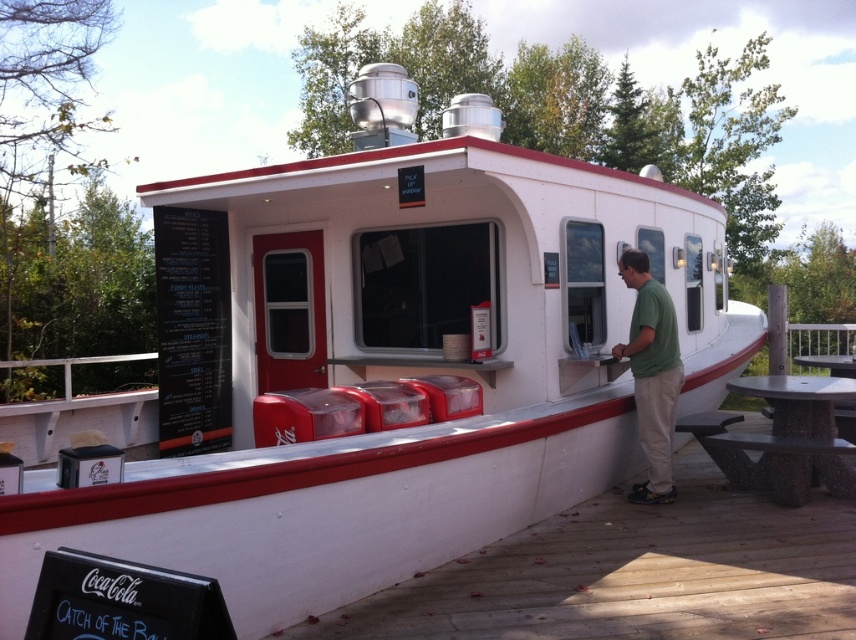
Question: Which object is the farthest from the green cotton shirt at center?

Choices:
 (A) dark brown stone picnic table at lower right
 (B) wooden at lower left

Answer: (B)

Question: Which point is farther to the camera?

Choices:
 (A) (831, 628)
 (B) (831, 424)

Answer: (B)

Question: Can you confirm if dark brown stone picnic table at lower right is wider than green cotton shirt at center?

Choices:
 (A) no
 (B) yes

Answer: (B)

Question: Is wooden at lower left to the right of green cotton shirt at center from the viewer's perspective?

Choices:
 (A) yes
 (B) no

Answer: (B)

Question: Is the position of dark brown stone picnic table at lower right more distant than that of green cotton shirt at center?

Choices:
 (A) yes
 (B) no

Answer: (B)

Question: Which object is the farthest from the green cotton shirt at center?

Choices:
 (A) dark brown stone picnic table at lower right
 (B) wooden at lower left

Answer: (B)